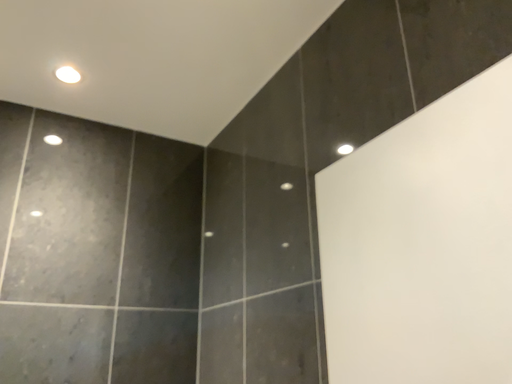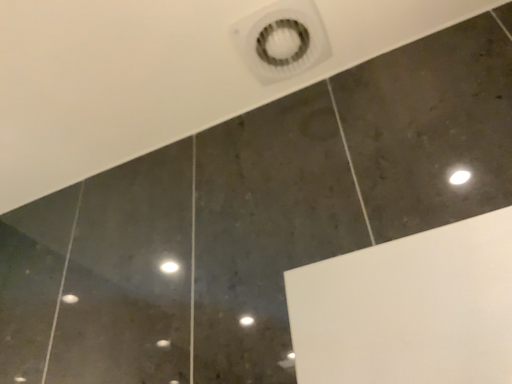
Question: How did the camera likely rotate when shooting the video?

Choices:
 (A) rotated upward
 (B) rotated downward

Answer: (A)